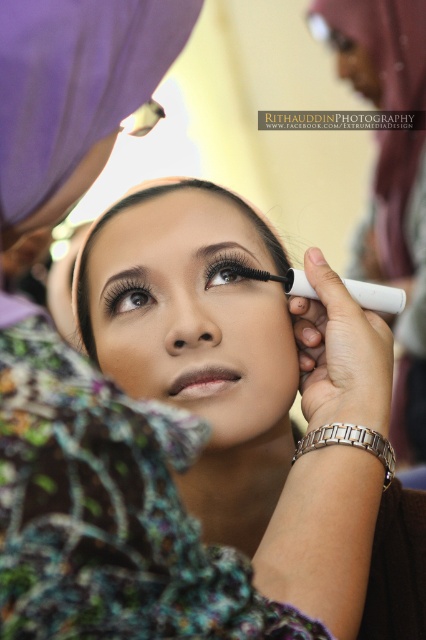
Is smooth skin face at center bigger than brown matte eyebrow at upper left?

Indeed, smooth skin face at center has a larger size compared to brown matte eyebrow at upper left.

Who is higher up, smooth skin face at center or brown matte eyebrow at upper left?

brown matte eyebrow at upper left

Who is more distant from viewer, (108, 342) or (114, 298)?

The point (114, 298) is more distant.

In order to click on smooth skin face at center in this screenshot , I will do `click(193, 317)`.

Can you confirm if matte white mascara at upper center is positioned to the left of brown matte eyebrow at upper left?

In fact, matte white mascara at upper center is to the right of brown matte eyebrow at upper left.

Is matte white mascara at upper center thinner than brown matte eyebrow at upper left?

No, matte white mascara at upper center is not thinner than brown matte eyebrow at upper left.

Find the location of `matte white mascara at upper center`. matte white mascara at upper center is located at coordinates (157, 518).

Based on the photo, does matte white mascara at upper center have a lesser height compared to smooth skin face at center?

Yes.

Does matte white mascara at upper center have a greater width compared to smooth skin face at center?

Correct, the width of matte white mascara at upper center exceeds that of smooth skin face at center.

Locate an element on the screen. matte white mascara at upper center is located at coordinates (157, 518).

Identify the location of matte white mascara at upper center. The height and width of the screenshot is (640, 426). (157, 518).